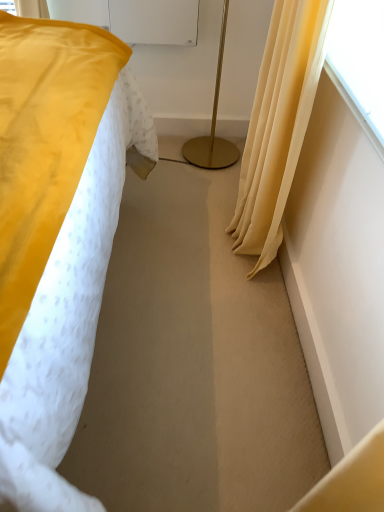
I want to click on free location in front of gold metallic floor lamp at center, so click(x=195, y=185).